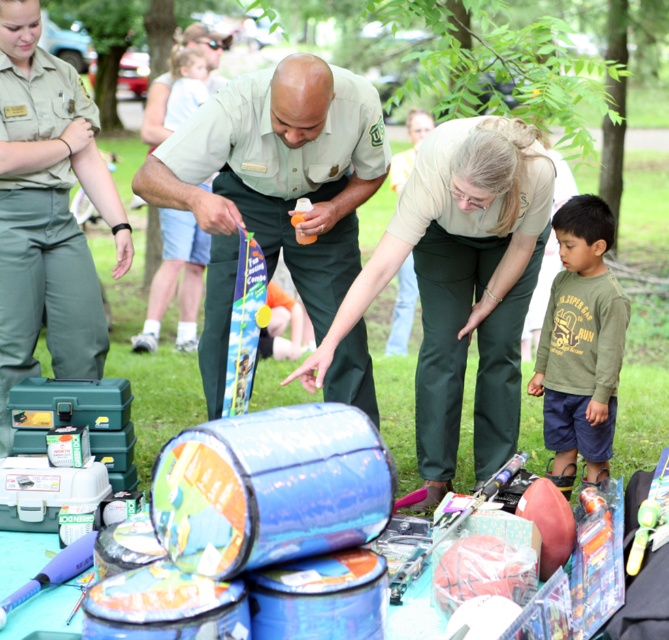
You are a child in the park who wants to pick up both the matte green pants at center and the translucent plastic bottle at center. Can you reach both items without moving your position?

The matte green pants at center and the translucent plastic bottle at center are 24.99 inches apart from each other. Since the distance between them is more than 24 inches, it might be difficult for a child to reach both items without moving their position.

You are organizing a childrens outdoor play area and need to store the matte green pants at center and the translucent plastic bottle at center in a storage bin. If the bin can only hold one of them due to size constraints, which item should you prioritize placing in the bin first?

The matte green pants at center has a larger size compared to the translucent plastic bottle at center, so you should prioritize placing the matte green pants at center first to ensure it fits in the bin before the smaller item.